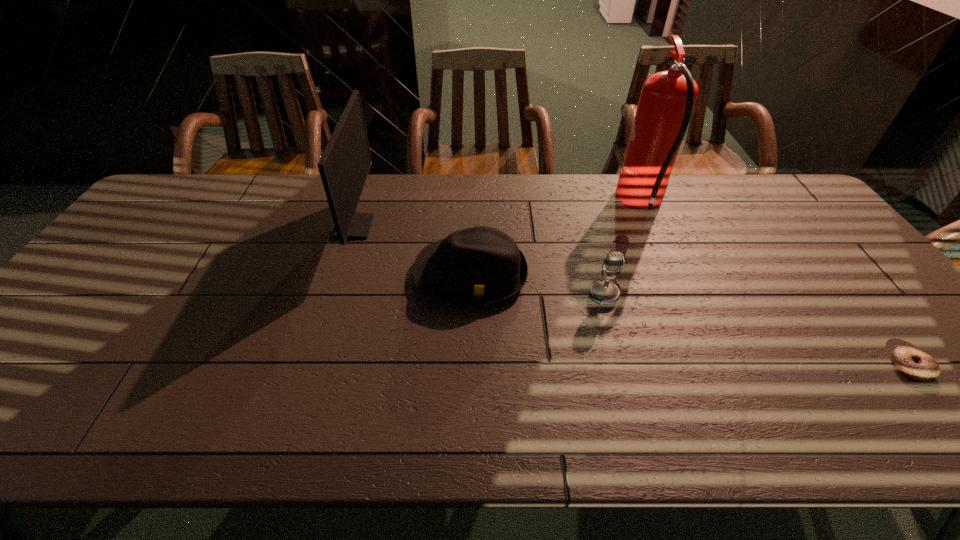
Locate an element on the screen. This screenshot has width=960, height=540. the fourth object from left to right is located at coordinates (667, 99).

Identify the location of fire extinguisher. (667, 99).

This screenshot has width=960, height=540. Identify the location of the leftmost object. point(344,165).

I want to click on the fourth shortest object, so click(344, 165).

Find the location of a particular element. the third object from left to right is located at coordinates (605, 292).

Where is `the fourth tallest object`? This screenshot has width=960, height=540. the fourth tallest object is located at coordinates (480, 265).

The width and height of the screenshot is (960, 540). I want to click on the fourth object from right to left, so click(480, 265).

Identify the location of the shortest object. The image size is (960, 540). (918, 365).

Find the location of a particular element. The height and width of the screenshot is (540, 960). the nearest object is located at coordinates (918, 365).

Find the location of a particular element. The height and width of the screenshot is (540, 960). vacant space situated 0.190m towards the nozzle of the fourth object from left to right is located at coordinates (561, 203).